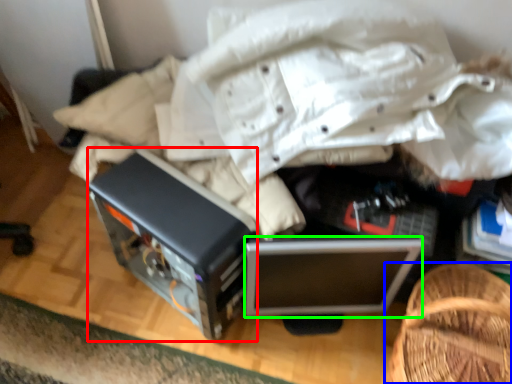
Question: Which is nearer to the appliance (highlighted by a red box)? furniture (highlighted by a blue box) or computer (highlighted by a green box).

Choices:
 (A) furniture
 (B) computer

Answer: (B)